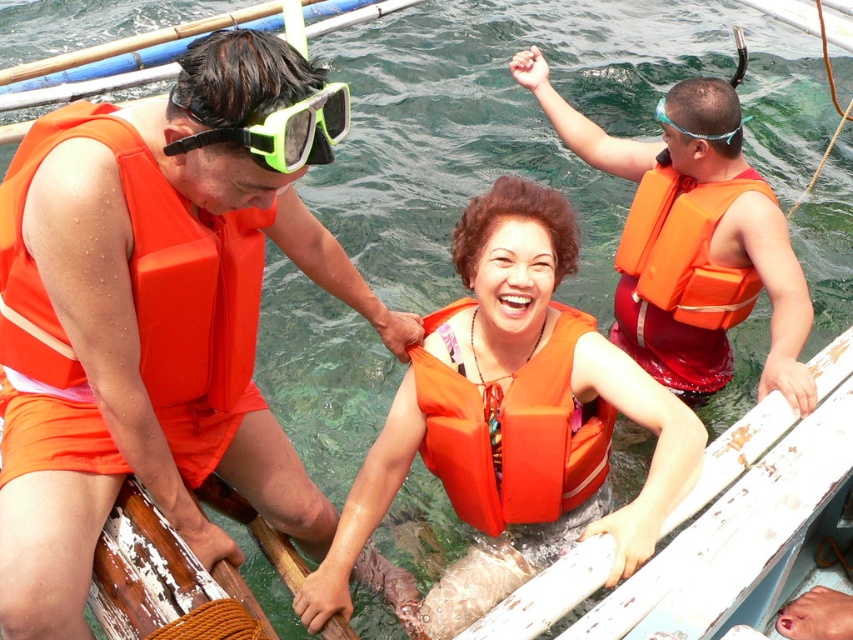
You are a safety inspector checking the gear on the boat. You notice the orange life vest at upper right and the green rubber goggles at upper center. Which of these two items is bigger in size?

The orange life vest at upper right is larger in size than the green rubber goggles at upper center.

You are on a boat and need to retrieve an object that fell into the water. You have two orange life jackets available. One is the orange life vest at center and the other is the orange foam life jacket at left. Which one is closer to the water surface?

The orange foam life jacket at left is closer to the water surface because it is above the orange life vest at center.